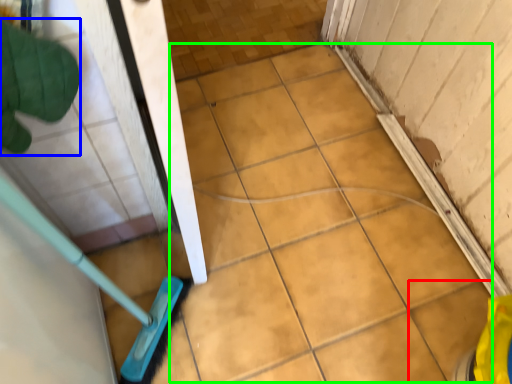
Question: Based on their relative distances, which object is nearer to ceramic tile (highlighted by a red box)? Choose from hand (highlighted by a blue box) and ceramic tile (highlighted by a green box).

Choices:
 (A) hand
 (B) ceramic tile

Answer: (B)